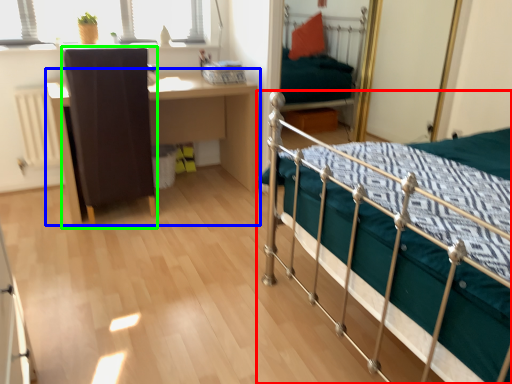
Question: Which object is the farthest from bed (highlighted by a red box)? Choose among these: desk (highlighted by a blue box) or chair (highlighted by a green box).

Choices:
 (A) desk
 (B) chair

Answer: (A)